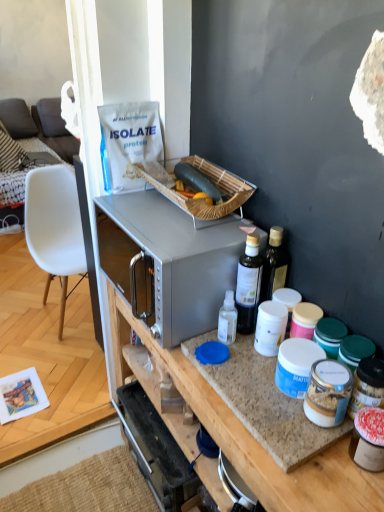
Locate an element on the screen. free space in front of bamboo picnic basket at upper center is located at coordinates (180, 232).